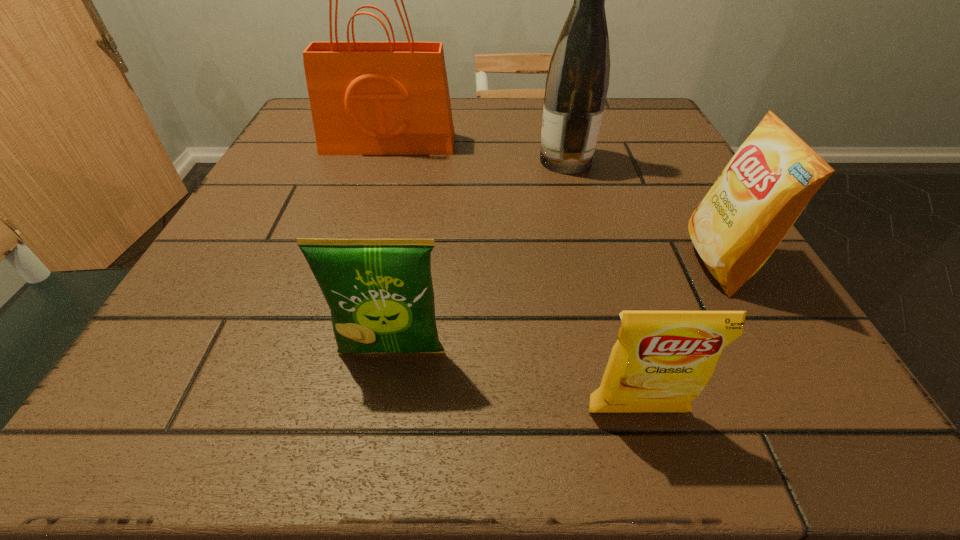
This screenshot has width=960, height=540. Identify the location of vacant space that's between the leftmost crisp (potato chip) and the wine bottle. (479, 256).

Locate which object is the fourth closest to the tallest object. Please provide its 2D coordinates. Your answer should be formatted as a tuple, i.e. [(x, y)], where the tuple contains the x and y coordinates of a point satisfying the conditions above.

[(662, 360)]

I want to click on the closest object to the nearest crisp (potato chip), so click(380, 292).

Identify which crisp (potato chip) is located as the second nearest to the second farthest crisp (potato chip). Please provide its 2D coordinates. Your answer should be formatted as a tuple, i.e. [(x, y)], where the tuple contains the x and y coordinates of a point satisfying the conditions above.

[(759, 195)]

Image resolution: width=960 pixels, height=540 pixels. I want to click on the closest crisp (potato chip) relative to the nearest crisp (potato chip), so click(380, 292).

You are a GUI agent. You are given a task and a screenshot of the screen. Output one action in this format:
    pyautogui.click(x=<x>, y=<y>)
    Task: Click on the vacant space that satisfies the following two spatial constraints: 1. on the front-facing side of the rightmost object; 2. on the front-facing side of the second nearest object
    The image size is (960, 540).
    Given the screenshot: What is the action you would take?
    pyautogui.click(x=769, y=352)

At what (x,y) coordinates should I click in order to perform the action: click on free location that satisfies the following two spatial constraints: 1. on the front-facing side of the third nearest object; 2. on the front-facing side of the second nearest crisp (potato chip). Please return your answer as a coordinate pair (x, y). Looking at the image, I should click on (769, 352).

Image resolution: width=960 pixels, height=540 pixels. I want to click on vacant space that satisfies the following two spatial constraints: 1. on the front-facing side of the rightmost object; 2. on the front-facing side of the leftmost crisp (potato chip), so click(x=769, y=352).